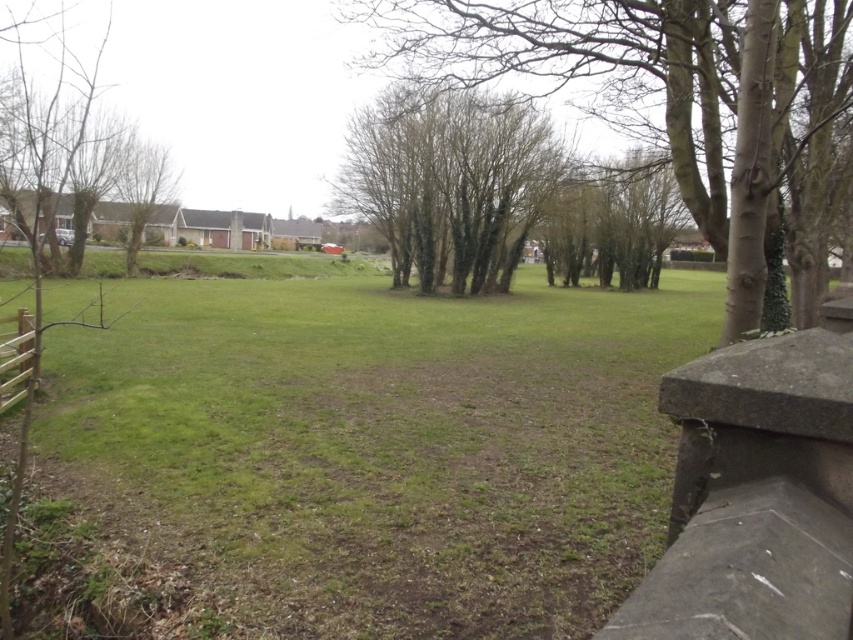
Does bare branches at center have a greater height compared to brown leafless tree at left?

No.

Does bare branches at center have a larger size compared to brown leafless tree at left?

No.

Is point (791, 252) farther from camera compared to point (67, 70)?

No, it is in front of (67, 70).

Locate an element on the screen. bare branches at center is located at coordinates (656, 92).

Which is below, brown leafless tree at left or brown wooden fence at lower left?

brown wooden fence at lower left is below.

Locate an element on the screen. The width and height of the screenshot is (853, 640). brown leafless tree at left is located at coordinates (73, 154).

This screenshot has height=640, width=853. I want to click on brown leafless tree at left, so click(x=73, y=154).

Is bare branches at center smaller than brown wooden fence at lower left?

Incorrect, bare branches at center is not smaller in size than brown wooden fence at lower left.

Looking at this image, who is higher up, bare branches at center or brown wooden fence at lower left?

bare branches at center is higher up.

Who is more forward, (712,80) or (10,371)?

Point (10,371) is in front.

Locate an element on the screen. bare branches at center is located at coordinates (656, 92).